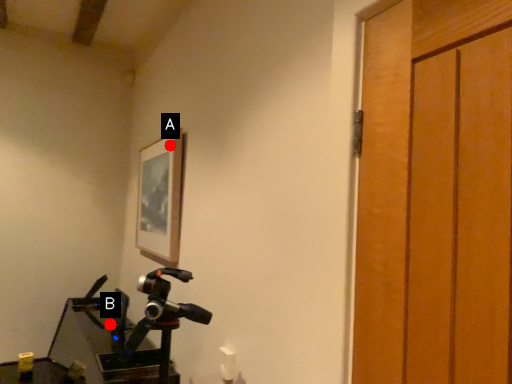
Question: Two points are circled on the image, labeled by A and B beside each circle. Among these points, which one is nearest to the camera?

Choices:
 (A) A is closer
 (B) B is closer

Answer: (A)